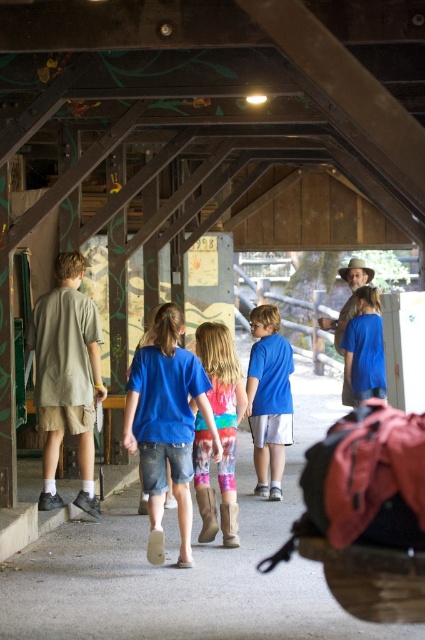
You are standing at the entrance of the wooden covered bridge and see two points marked on the floor. The first point is at coordinate point (221, 525) and the second is at point (268, 353). If you want to reach the point that is closer to the exit of the bridge, which coordinate should you walk towards?

Point (221, 525) is in front of point (268, 353), so you should walk towards point (221, 525) to reach the exit faster.